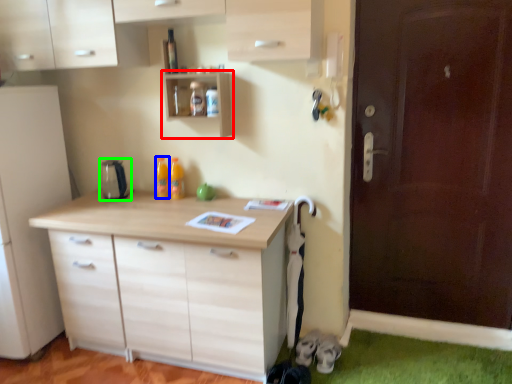
Question: Considering the real-world distances, which object is farthest from shelf (highlighted by a red box)? bottle (highlighted by a blue box) or appliance (highlighted by a green box)?

Choices:
 (A) bottle
 (B) appliance

Answer: (B)